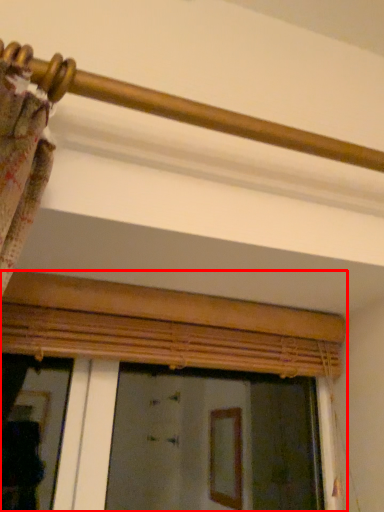
Question: From the image's perspective, what is the correct spatial relationship of window (annotated by the red box) in relation to rail?

Choices:
 (A) below
 (B) above

Answer: (A)